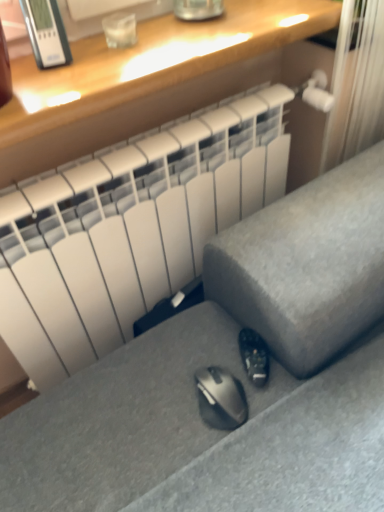
This screenshot has width=384, height=512. What are the coordinates of `vacant space situated above matte wood desk at upper center (from a real-world perspective)` in the screenshot? It's located at (144, 46).